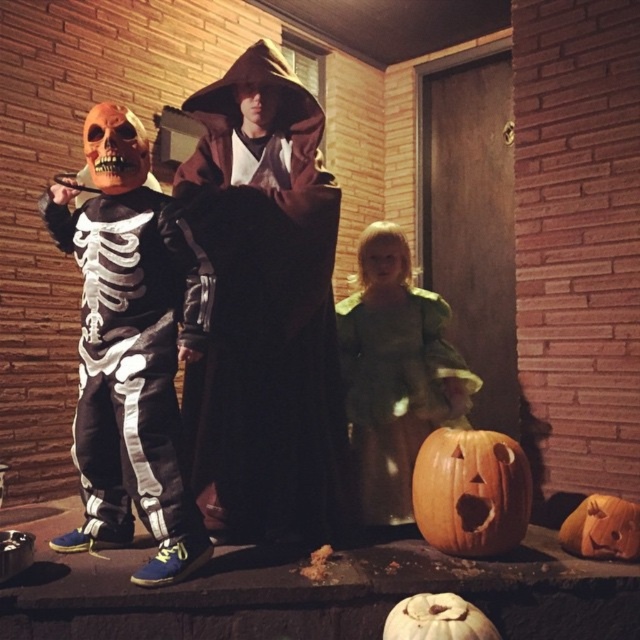
You are a trick or treater and you want to choose the pumpkin with the smaller size between the carved wood pumpkin at lower center and the orange matte pumpkin at lower center. Which one should you pick?

The orange matte pumpkin at lower center is smaller in width compared to the carved wood pumpkin at lower center, so you should pick the orange matte pumpkin at lower center.

Looking at this image, you are a trick or treater and you see two pumpkins, the carved wood pumpkin at lower center and the orange matte pumpkin at lower center. Which pumpkin is larger?

The carved wood pumpkin at lower center is bigger than the orange matte pumpkin at lower center.

You are a photographer taking a picture of the scene described. You notice the green fabric dress at center and the orange matte pumpkin at lower center. Which object is positioned higher in the frame?

The green fabric dress at center is located above the orange matte pumpkin at lower center, so it is positioned higher in the frame.